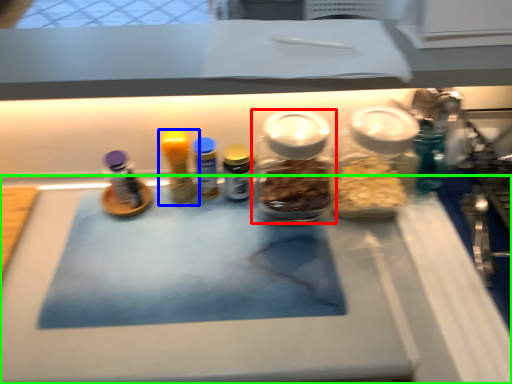
Question: Based on their relative distances, which object is farther from bottle (highlighted by a red box)? Choose from bottle (highlighted by a blue box) and table (highlighted by a green box).

Choices:
 (A) bottle
 (B) table

Answer: (B)